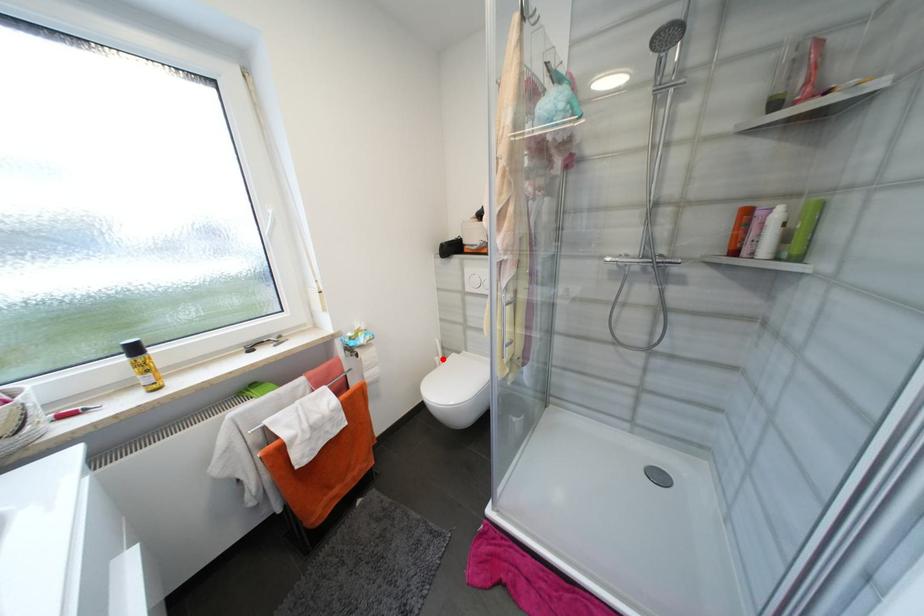
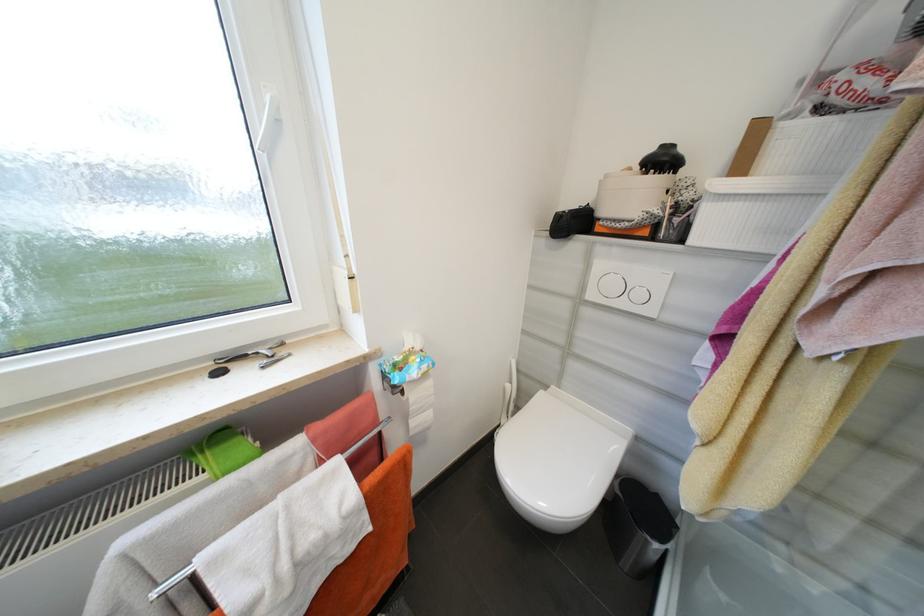
Question: I am providing you with two images of the same scene from different viewpoints. In image1, a red point is highlighted. Considering the same 3D point in image2, which of the following is correct?

Choices:
 (A) It is closer
 (B) It is farther

Answer: (A)